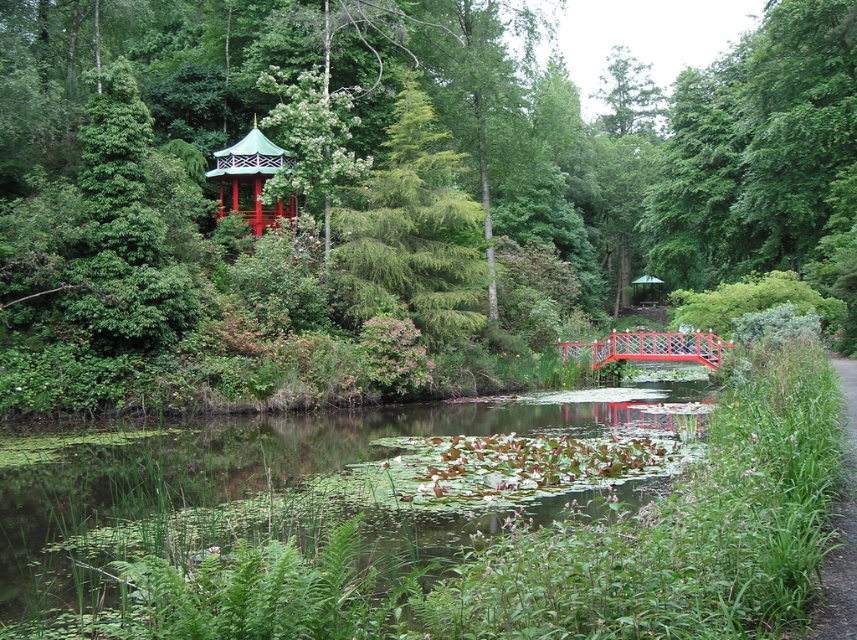
You are a drone operator trying to capture a photo of the green glossy pagoda at upper center. The camera is currently positioned at point 0.3, 0.45. Is the drone already aligned with the pagoda?

The green glossy pagoda at upper center is located at point (387, 188). The camera is at (385, 192). The coordinates are very close, so the drone is likely aligned with the pagoda.